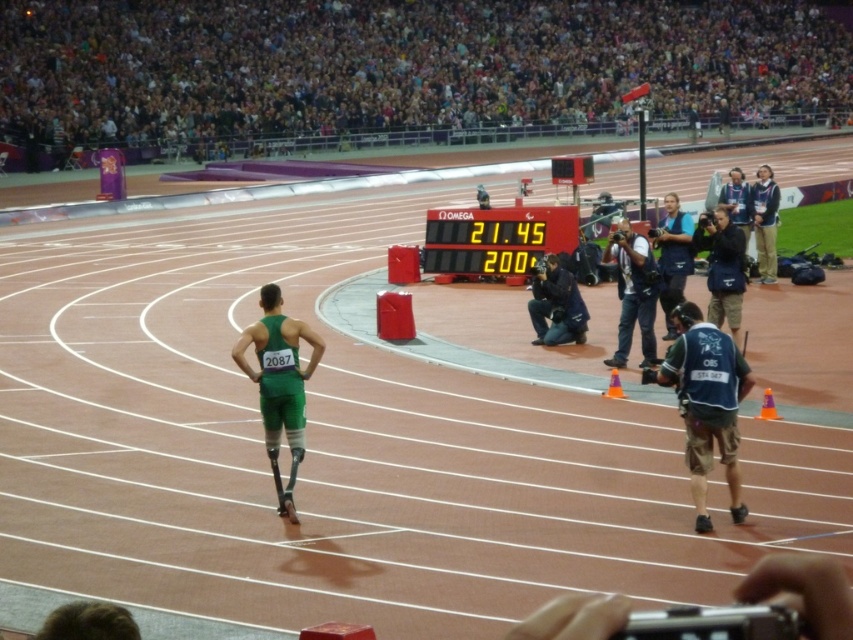
Question: Among these objects, which one is farthest from the camera?

Choices:
 (A) dark blue fabric bag at right
 (B) dark blue fabric vest at center right
 (C) dark blue shirt at right
 (D) dark blue uniform at upper right

Answer: (D)

Question: Can you confirm if black digital scoreboard at center is positioned to the right of dark blue jacket at upper right?

Choices:
 (A) yes
 (B) no

Answer: (B)

Question: Is dark blue jacket at upper right below dark blue uniform at upper right?

Choices:
 (A) yes
 (B) no

Answer: (A)

Question: Does dark blue shirt at right appear on the left side of dark blue jacket at upper right?

Choices:
 (A) yes
 (B) no

Answer: (A)

Question: Among these points, which one is farthest from the camera?

Choices:
 (A) (x=509, y=211)
 (B) (x=294, y=449)

Answer: (A)

Question: Which object appears closest to the camera in this image?

Choices:
 (A) dark blue fabric vest at center right
 (B) green matte prosthetic leg at center

Answer: (A)